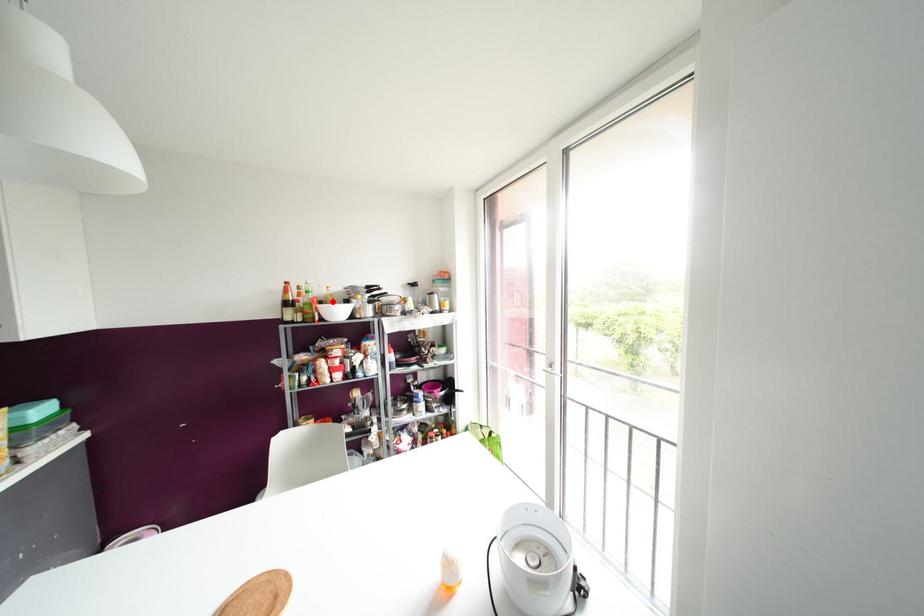
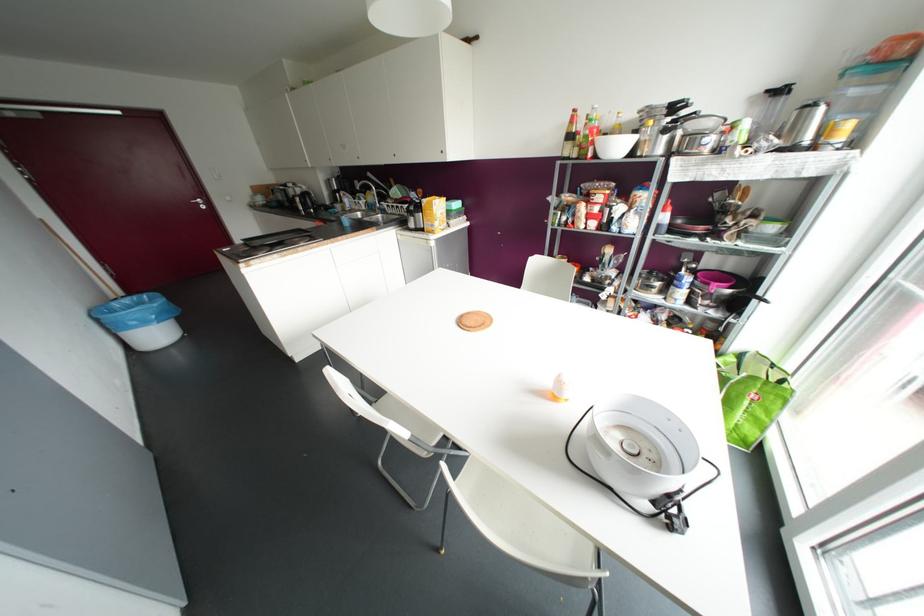
Locate, in the second image, the point that corresponds to the highlighted location in the first image.

(618, 134)